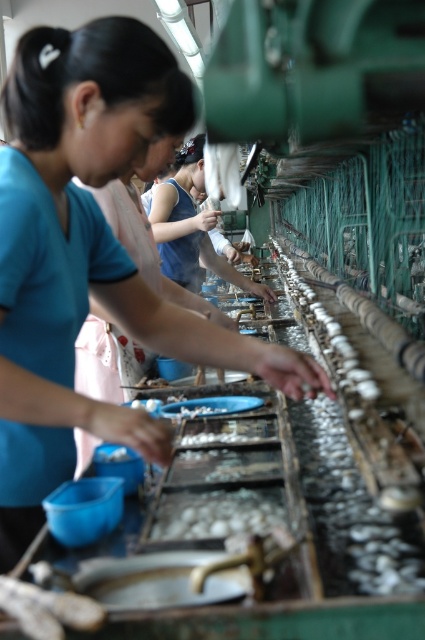
Can you confirm if matte blue shirt at center is positioned above white glossy oyster at center?

Yes.

Describe the element at coordinates (87, 260) in the screenshot. I see `matte blue shirt at center` at that location.

Locate an element on the screen. matte blue shirt at center is located at coordinates (87, 260).